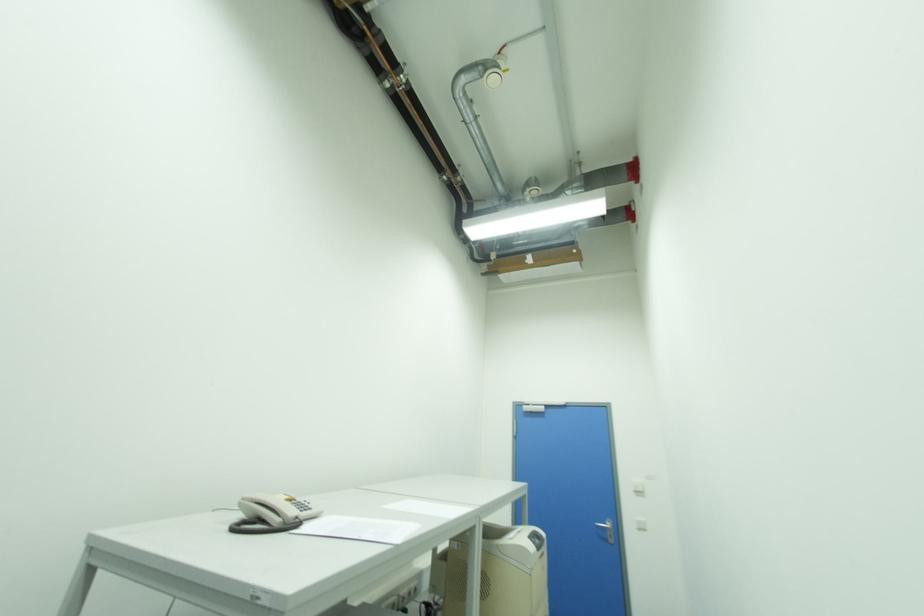
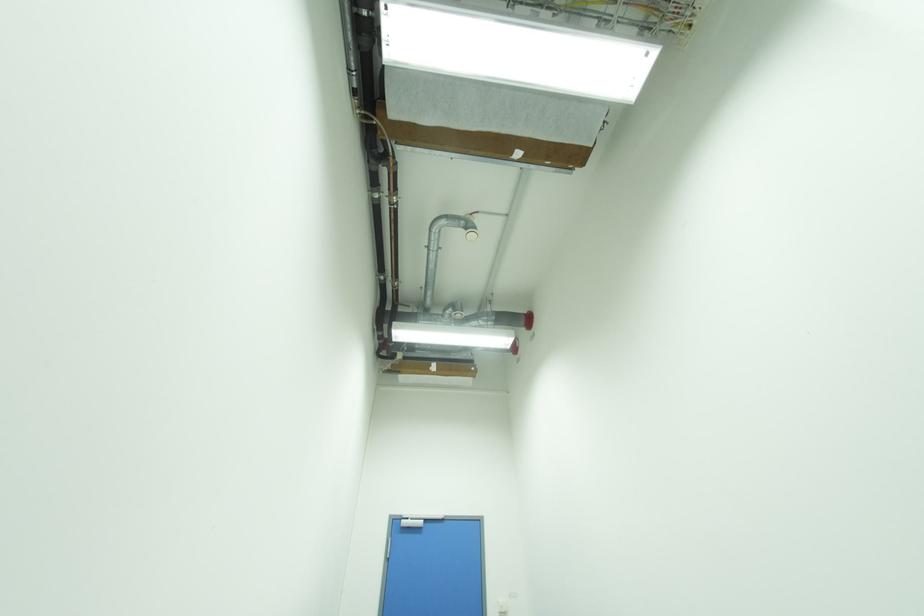
The images are taken continuously from a first-person perspective. In which direction is your viewpoint rotating?

The rotation direction of the camera is right-up.